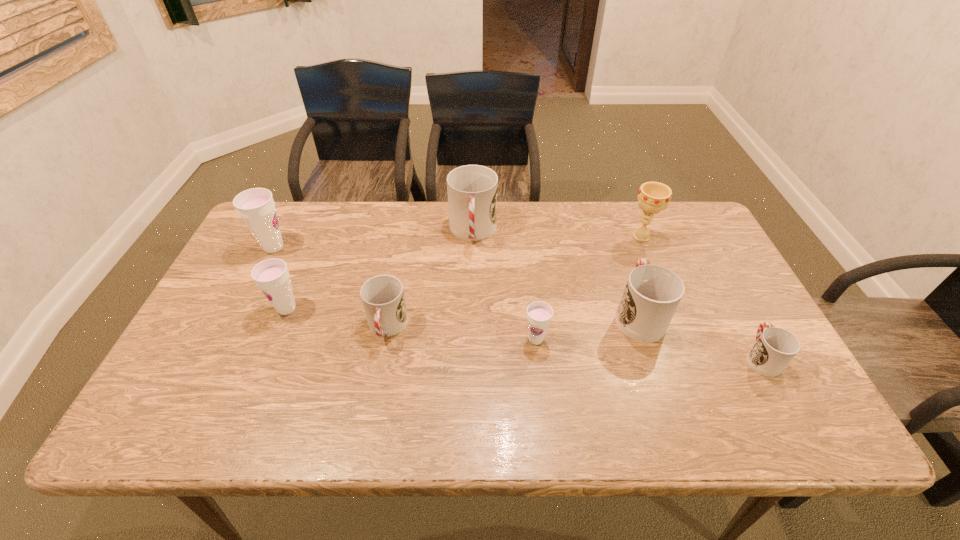
This screenshot has height=540, width=960. In order to click on vacant region between the third smallest red cup and the farthest red cup in this screenshot , I will do `click(556, 273)`.

Find the location of a particular element. The width and height of the screenshot is (960, 540). free area in between the second cup from left to right and the shortest cup is located at coordinates (524, 333).

Locate an element on the screen. vacant area that lies between the second smallest red cup and the chalice is located at coordinates (515, 282).

Locate an element on the screen. empty space that is in between the second smallest red cup and the second purple cup from left to right is located at coordinates (337, 318).

Identify the location of vacant area between the third smallest red cup and the second object from left to right. (463, 312).

The image size is (960, 540). I want to click on vacant area between the shortest cup and the chalice, so click(x=701, y=297).

Locate an element on the screen. The height and width of the screenshot is (540, 960). unoccupied area between the rightmost red cup and the farthest red cup is located at coordinates (617, 295).

Where is `free space between the chalice and the sixth cup from right to left`? This screenshot has width=960, height=540. free space between the chalice and the sixth cup from right to left is located at coordinates pyautogui.click(x=464, y=273).

Choose which object is the second nearest neighbor to the rightmost red cup. Please provide its 2D coordinates. Your answer should be formatted as a tuple, i.e. [(x, y)], where the tuple contains the x and y coordinates of a point satisfying the conditions above.

[(653, 197)]

Find the location of `object that stands as the seventh closest to the shortest cup`. object that stands as the seventh closest to the shortest cup is located at coordinates (256, 206).